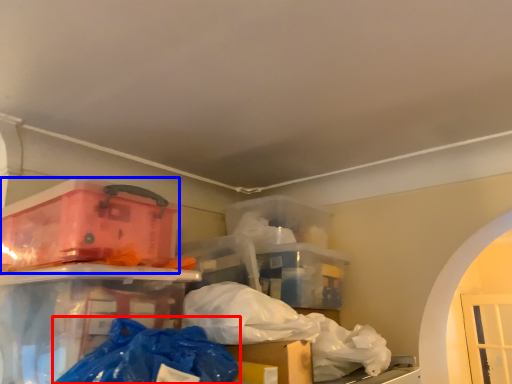
Question: Which of the following is the farthest to the observer, plastic bag (highlighted by a red box) or box (highlighted by a blue box)?

Choices:
 (A) plastic bag
 (B) box

Answer: (B)